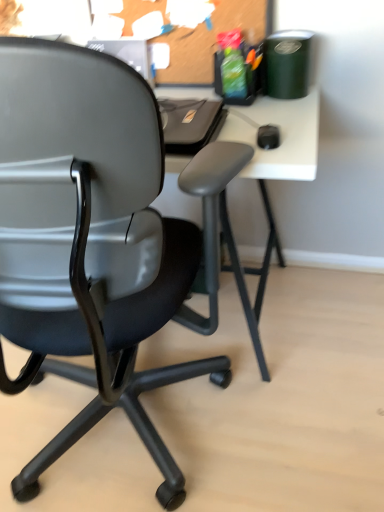
Question: From a real-world perspective, is matte black chair at left positioned over burlap corkboard at upper center based on gravity?

Choices:
 (A) yes
 (B) no

Answer: (B)

Question: From the image's perspective, is matte black chair at left beneath burlap corkboard at upper center?

Choices:
 (A) yes
 (B) no

Answer: (A)

Question: Is matte black chair at left positioned with its back to burlap corkboard at upper center?

Choices:
 (A) no
 (B) yes

Answer: (A)

Question: Can you confirm if matte black chair at left is bigger than burlap corkboard at upper center?

Choices:
 (A) yes
 (B) no

Answer: (A)

Question: Would you say burlap corkboard at upper center is part of matte black chair at left's contents?

Choices:
 (A) yes
 (B) no

Answer: (B)

Question: Is matte black chair at left far from burlap corkboard at upper center?

Choices:
 (A) no
 (B) yes

Answer: (A)

Question: Could you tell me if burlap corkboard at upper center is facing matte black chair at left?

Choices:
 (A) yes
 (B) no

Answer: (B)

Question: Is burlap corkboard at upper center bigger than matte black chair at left?

Choices:
 (A) no
 (B) yes

Answer: (A)

Question: Is burlap corkboard at upper center smaller than matte black chair at left?

Choices:
 (A) no
 (B) yes

Answer: (B)

Question: Is burlap corkboard at upper center oriented away from matte black chair at left?

Choices:
 (A) no
 (B) yes

Answer: (A)

Question: Considering the relative sizes of burlap corkboard at upper center and matte black chair at left in the image provided, is burlap corkboard at upper center shorter than matte black chair at left?

Choices:
 (A) yes
 (B) no

Answer: (A)

Question: From the image's perspective, would you say burlap corkboard at upper center is shown under matte black chair at left?

Choices:
 (A) no
 (B) yes

Answer: (A)

Question: In terms of height, does matte black chair at left look taller or shorter compared to burlap corkboard at upper center?

Choices:
 (A) short
 (B) tall

Answer: (B)